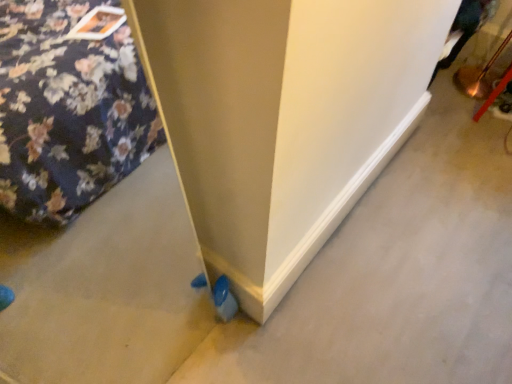
This screenshot has width=512, height=384. In order to click on vacant area that is situated to the right of blue rubber toy at lower center in this screenshot , I will do `click(272, 328)`.